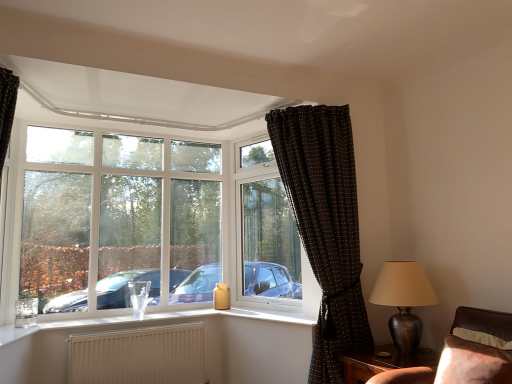
I want to click on metallic bronze table lamp at right, so 404,301.

This screenshot has width=512, height=384. Describe the element at coordinates (182, 317) in the screenshot. I see `white plastic vase at lower center` at that location.

This screenshot has height=384, width=512. What do you see at coordinates (115, 216) in the screenshot?
I see `white plastic window at upper left` at bounding box center [115, 216].

Find the location of `black dotted fabric curtain at left, which is counted as the second curtain, starting from the right`. black dotted fabric curtain at left, which is counted as the second curtain, starting from the right is located at coordinates (6, 117).

Measure the distance between brown leather couch at lower right and camera.

brown leather couch at lower right and camera are 6.15 feet apart.

The height and width of the screenshot is (384, 512). Describe the element at coordinates (464, 355) in the screenshot. I see `brown leather couch at lower right` at that location.

The height and width of the screenshot is (384, 512). Find the location of `white plastic window at center`. white plastic window at center is located at coordinates (268, 234).

Which of these two, metallic bronze table lamp at right or white plastic window at upper left, stands shorter?

Standing shorter between the two is metallic bronze table lamp at right.

Is metallic bronze table lamp at right not within white plastic window at upper left?

Yes, metallic bronze table lamp at right is located beyond the bounds of white plastic window at upper left.

Where is `table lamp below the white plastic window at upper left (from the image's perspective)`? The width and height of the screenshot is (512, 384). table lamp below the white plastic window at upper left (from the image's perspective) is located at coordinates (404, 301).

From the picture: Is metallic bronze table lamp at right positioned behind white plastic window at upper left?

No, metallic bronze table lamp at right is closer to the camera.

Which curtain is the 1st one when counting from the front of the white plastic window at upper left? Please provide its 2D coordinates.

[(6, 117)]

In the scene shown: Considering the positions of objects black dotted fabric curtain at left, which is counted as the second curtain, starting from the right, and white plastic window at upper left in the image provided, who is behind, black dotted fabric curtain at left, which is counted as the second curtain, starting from the right, or white plastic window at upper left?

Positioned behind is white plastic window at upper left.

Can you confirm if black dotted fabric curtain at left, which is counted as the second curtain, starting from the right, is thinner than white plastic window at upper left?

No.

Is white textured radiator at lower center bigger than metallic bronze table lamp at right?

No.

From the image's perspective, is white textured radiator at lower center above or below metallic bronze table lamp at right?

white textured radiator at lower center is below metallic bronze table lamp at right.

How many degrees apart are the facing directions of white textured radiator at lower center and metallic bronze table lamp at right?

white textured radiator at lower center and metallic bronze table lamp at right are facing 92.9 degrees away from each other.

Is white plastic vase at lower center bigger than white plastic window at upper left?

No, white plastic vase at lower center is not bigger than white plastic window at upper left.

Is point (47, 323) closer or farther from the camera than point (185, 214)?

Point (47, 323) is positioned closer to the camera compared to point (185, 214).

From the image's perspective, would you say white plastic vase at lower center is shown under white plastic window at upper left?

Yes, from the image's perspective, white plastic vase at lower center is below white plastic window at upper left.

Could you tell me if white plastic vase at lower center is facing white plastic window at upper left?

No.

Locate an element on the screen. This screenshot has width=512, height=384. table lamp beneath the black dotted fabric curtain at left, which is counted as the second curtain, starting from the right (from a real-world perspective) is located at coordinates (404, 301).

Who is shorter, black dotted fabric curtain at left, which is counted as the second curtain, starting from the right, or metallic bronze table lamp at right?

metallic bronze table lamp at right.

Can you confirm if black dotted fabric curtain at left, placed as the first curtain when sorted from left to right, is thinner than metallic bronze table lamp at right?

Indeed, black dotted fabric curtain at left, placed as the first curtain when sorted from left to right, has a lesser width compared to metallic bronze table lamp at right.

Is black dotted fabric curtain at left, which is counted as the second curtain, starting from the right, completely or partially outside of metallic bronze table lamp at right?

Yes, black dotted fabric curtain at left, which is counted as the second curtain, starting from the right, is outside of metallic bronze table lamp at right.

Which of these two, brown dotted fabric curtain at upper right, which is the second curtain from left to right, or white textured radiator at lower center, is thinner?

→ white textured radiator at lower center.

Considering the relative sizes of brown dotted fabric curtain at upper right, which is the 1th curtain from right to left, and white textured radiator at lower center in the image provided, is brown dotted fabric curtain at upper right, which is the 1th curtain from right to left, bigger than white textured radiator at lower center?

Correct, brown dotted fabric curtain at upper right, which is the 1th curtain from right to left, is larger in size than white textured radiator at lower center.

Between brown dotted fabric curtain at upper right, which is the second curtain from left to right, and white textured radiator at lower center, which one appears on the left side from the viewer's perspective?

Positioned to the left is white textured radiator at lower center.

Is brown dotted fabric curtain at upper right, which is the second curtain from left to right, far away from white textured radiator at lower center?

brown dotted fabric curtain at upper right, which is the second curtain from left to right, is positioned a significant distance from white textured radiator at lower center.

Does point (1, 92) come closer to viewer compared to point (63, 327)?

Yes, it is in front of point (63, 327).

Looking at the image, does black dotted fabric curtain at left, which is counted as the second curtain, starting from the right, seem bigger or smaller compared to white plastic vase at lower center?

black dotted fabric curtain at left, which is counted as the second curtain, starting from the right, is bigger than white plastic vase at lower center.

At what (x,y) coordinates should I click in order to perform the action: click on curtain on the left of white plastic vase at lower center. Please return your answer as a coordinate pair (x, y). Looking at the image, I should click on (6, 117).

Is white plastic vase at lower center at the back of black dotted fabric curtain at left, placed as the first curtain when sorted from left to right?

black dotted fabric curtain at left, placed as the first curtain when sorted from left to right, is not turned away from white plastic vase at lower center.

Find the location of a particular element. Image resolution: width=512 pixels, height=384 pixels. table lamp in front of the white plastic window at upper left is located at coordinates (404, 301).

The image size is (512, 384). I want to click on bay window above the black dotted fabric curtain at left, placed as the first curtain when sorted from left to right (from a real-world perspective), so click(x=115, y=216).

Considering their positions, is brown leather couch at lower right positioned further to white plastic window at upper left than white plastic vase at lower center?

Among the two, brown leather couch at lower right is located further to white plastic window at upper left.

When comparing their distances from brown leather couch at lower right, does brown dotted fabric curtain at upper right, which is the second curtain from left to right, or white textured radiator at lower center seem closer?

The object closer to brown leather couch at lower right is brown dotted fabric curtain at upper right, which is the second curtain from left to right.

Which object lies further to the anchor point brown leather couch at lower right, black dotted fabric curtain at left, which is counted as the second curtain, starting from the right, or white plastic window at center?

black dotted fabric curtain at left, which is counted as the second curtain, starting from the right.

Considering their positions, is white textured radiator at lower center positioned further to brown dotted fabric curtain at upper right, which is the 1th curtain from right to left, than white plastic vase at lower center?

Based on the image, white textured radiator at lower center appears to be further to brown dotted fabric curtain at upper right, which is the 1th curtain from right to left.

Considering their positions, is black dotted fabric curtain at left, placed as the first curtain when sorted from left to right, positioned further to white textured radiator at lower center than brown wooden table at lower right?

brown wooden table at lower right lies further to white textured radiator at lower center than the other object.

Looking at the image, which one is located closer to white plastic window at upper left, black dotted fabric curtain at left, placed as the first curtain when sorted from left to right, or white plastic vase at lower center?

white plastic vase at lower center is closer to white plastic window at upper left.

From the image, which object appears to be farther from white plastic vase at lower center, white plastic window at upper left or metallic bronze table lamp at right?

metallic bronze table lamp at right lies further to white plastic vase at lower center than the other object.

From the picture: Based on their spatial positions, is black dotted fabric curtain at left, which is counted as the second curtain, starting from the right, or metallic bronze table lamp at right closer to white plastic window at upper left?

black dotted fabric curtain at left, which is counted as the second curtain, starting from the right, is positioned closer to the anchor white plastic window at upper left.

The width and height of the screenshot is (512, 384). In order to click on curtain located between white textured radiator at lower center and metallic bronze table lamp at right in the left-right direction in this screenshot , I will do `click(325, 224)`.

The width and height of the screenshot is (512, 384). I want to click on radiator between black dotted fabric curtain at left, placed as the first curtain when sorted from left to right, and metallic bronze table lamp at right from left to right, so pyautogui.click(x=139, y=356).

Find the location of a particular element. window frame between white plastic window at upper left and brown dotted fabric curtain at upper right, which is the 1th curtain from right to left is located at coordinates coord(268,234).

Identify the location of window frame between white plastic vase at lower center and brown leather couch at lower right from left to right. Image resolution: width=512 pixels, height=384 pixels. (268, 234).